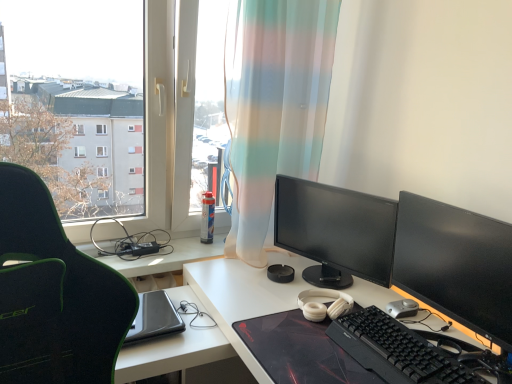
Find the location of `blank area beneath black textured mousepad at center (from a real-world perspective)`. blank area beneath black textured mousepad at center (from a real-world perspective) is located at coordinates (310, 349).